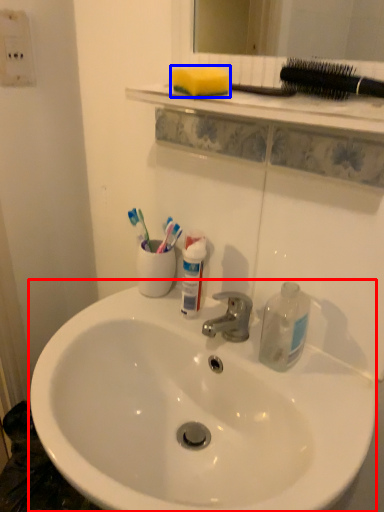
Question: Which point is further to the camera, sink (highlighted by a red box) or soap (highlighted by a blue box)?

Choices:
 (A) sink
 (B) soap

Answer: (B)